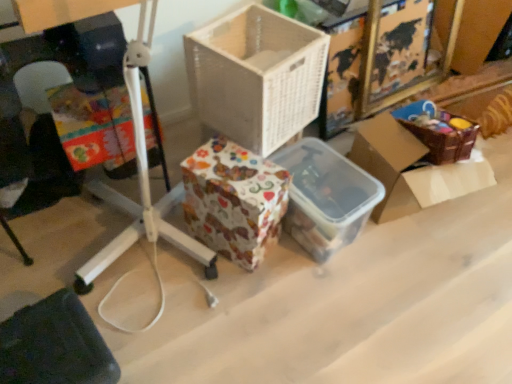
Question: From the image's perspective, is translucent plastic container at center, the first storage box in the right-to-left sequence, on dark fabric at lower left?

Choices:
 (A) no
 (B) yes

Answer: (B)

Question: Is translucent plastic container at center, which is the 2th storage box from left to right, positioned behind dark fabric at lower left?

Choices:
 (A) yes
 (B) no

Answer: (A)

Question: Is translucent plastic container at center, the first storage box in the right-to-left sequence, smaller than dark fabric at lower left?

Choices:
 (A) yes
 (B) no

Answer: (B)

Question: Is translucent plastic container at center, which is the 2th storage box from left to right, facing towards dark fabric at lower left?

Choices:
 (A) no
 (B) yes

Answer: (A)

Question: Does translucent plastic container at center, the first storage box in the right-to-left sequence, have a larger size compared to dark fabric at lower left?

Choices:
 (A) yes
 (B) no

Answer: (A)

Question: Can you confirm if translucent plastic container at center, the first storage box in the right-to-left sequence, is positioned to the right of dark fabric at lower left?

Choices:
 (A) no
 (B) yes

Answer: (B)

Question: Is patterned paper storage box at center, positioned as the 2th storage box in right-to-left order, far from white wicker basket at center, the 1th box when ordered from left to right?

Choices:
 (A) no
 (B) yes

Answer: (A)

Question: Considering the relative positions of patterned paper storage box at center, which ranks as the 1th storage box in left-to-right order, and white wicker basket at center, the 1th box when ordered from left to right, in the image provided, is patterned paper storage box at center, which ranks as the 1th storage box in left-to-right order, to the left of white wicker basket at center, the 1th box when ordered from left to right, from the viewer's perspective?

Choices:
 (A) no
 (B) yes

Answer: (B)

Question: Is patterned paper storage box at center, positioned as the 2th storage box in right-to-left order, further to camera compared to white wicker basket at center, the second box in the right-to-left sequence?

Choices:
 (A) yes
 (B) no

Answer: (A)

Question: From a real-world perspective, is patterned paper storage box at center, which ranks as the 1th storage box in left-to-right order, physically below white wicker basket at center, the 1th box when ordered from left to right?

Choices:
 (A) yes
 (B) no

Answer: (A)

Question: Can you confirm if patterned paper storage box at center, which ranks as the 1th storage box in left-to-right order, is smaller than white wicker basket at center, the second box in the right-to-left sequence?

Choices:
 (A) no
 (B) yes

Answer: (B)

Question: Considering the relative sizes of patterned paper storage box at center, which ranks as the 1th storage box in left-to-right order, and white wicker basket at center, the second box in the right-to-left sequence, in the image provided, is patterned paper storage box at center, which ranks as the 1th storage box in left-to-right order, bigger than white wicker basket at center, the second box in the right-to-left sequence,?

Choices:
 (A) no
 (B) yes

Answer: (A)

Question: Can you confirm if brown woven basket at upper right, positioned as the first box in right-to-left order, is shorter than translucent plastic container at center, the first storage box in the right-to-left sequence?

Choices:
 (A) no
 (B) yes

Answer: (A)